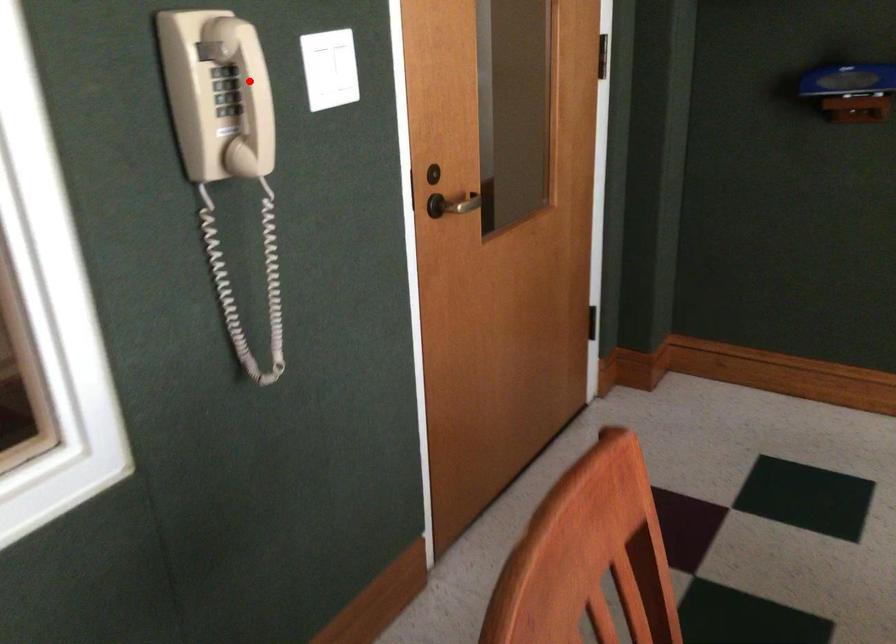
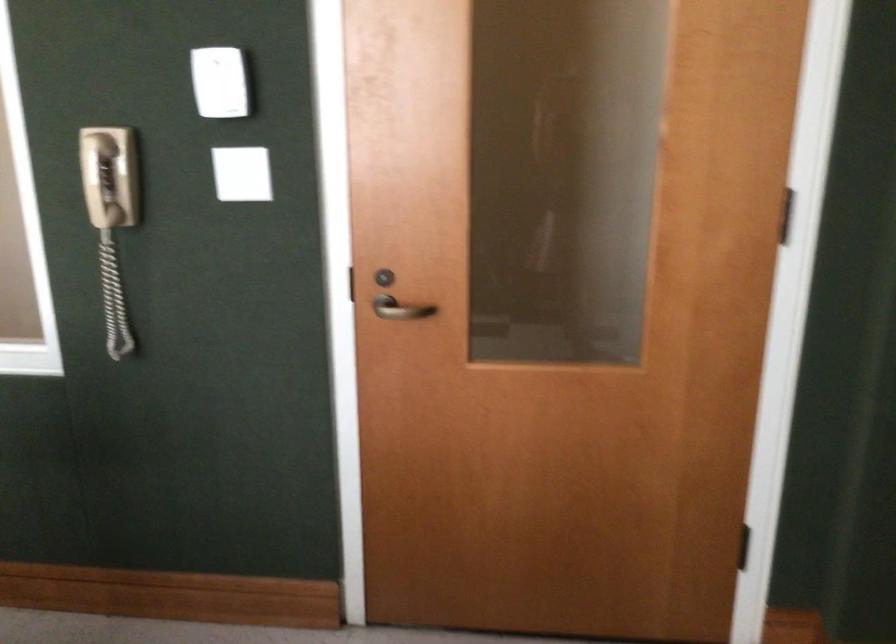
Question: I am providing you with two images of the same scene from different viewpoints. A red point is marked on the first image. At the location where the point appears in image 1, is it still visible in image 2?

Choices:
 (A) Yes
 (B) No

Answer: (A)